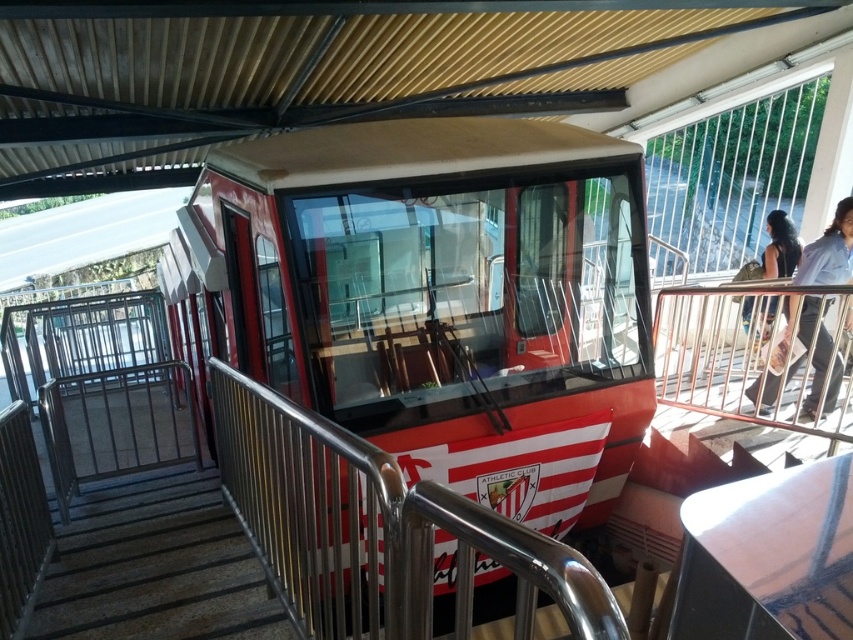
Question: Estimate the real-world distances between objects in this image. Which object is farther from the red glossy train at center?

Choices:
 (A) dark brown hair at upper right
 (B) dark hair at upper right

Answer: (A)

Question: Does dark hair at upper right appear over dark brown hair at upper right?

Choices:
 (A) yes
 (B) no

Answer: (B)

Question: Which point appears farthest from the camera in this image?

Choices:
 (A) (138, 522)
 (B) (440, 545)
 (C) (788, 244)

Answer: (C)

Question: Is metallic gray stairs at lower left thinner than dark brown hair at upper right?

Choices:
 (A) yes
 (B) no

Answer: (B)

Question: Does metallic gray stairs at lower left appear on the right side of dark brown hair at upper right?

Choices:
 (A) no
 (B) yes

Answer: (A)

Question: Based on their relative distances, which object is farther from the dark hair at upper right?

Choices:
 (A) red glossy train at center
 (B) dark brown hair at upper right

Answer: (A)